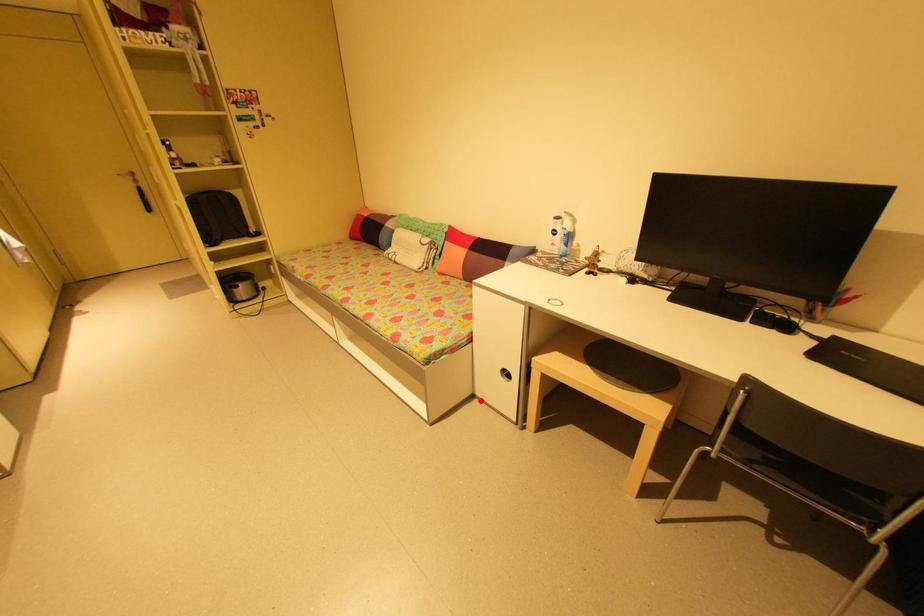
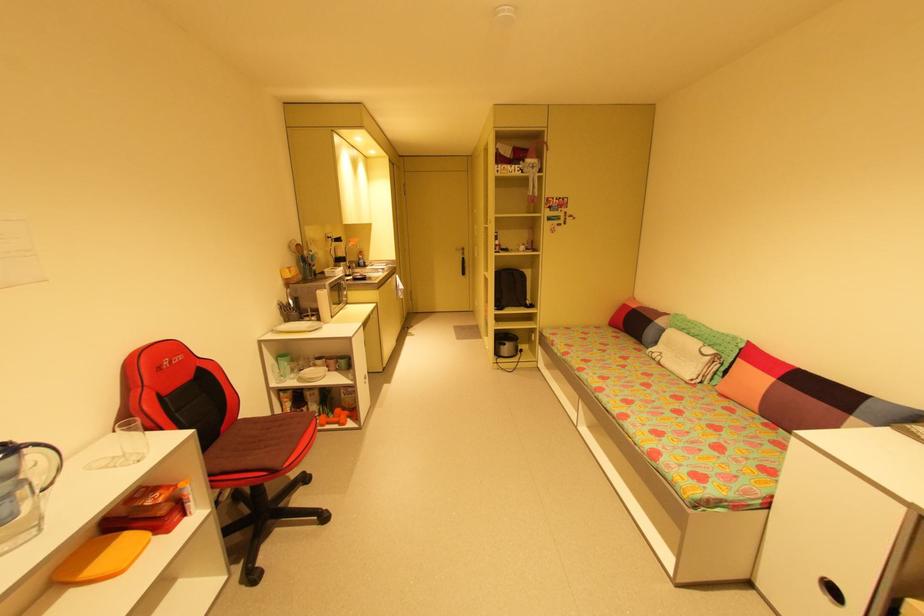
The point at the highlighted location is marked in the first image. Where is the corresponding point in the second image?

(758, 593)